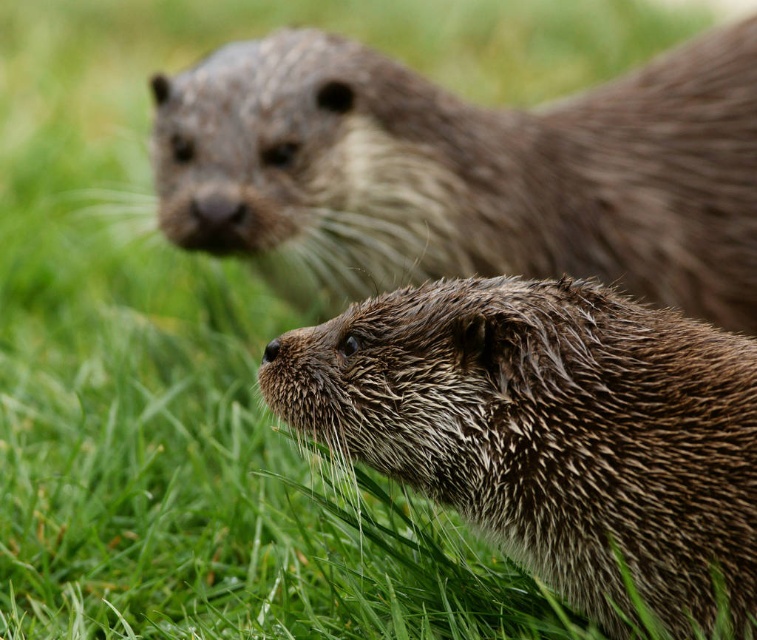
Question: Is brown fuzzy otter at upper center behind wet fur otter at center?

Choices:
 (A) no
 (B) yes

Answer: (B)

Question: Which of the following is the closest to the observer?

Choices:
 (A) brown fuzzy otter at upper center
 (B) wet fur otter at center

Answer: (B)

Question: Among these objects, which one is nearest to the camera?

Choices:
 (A) brown fuzzy otter at upper center
 (B) wet fur otter at center

Answer: (B)

Question: Is brown fuzzy otter at upper center smaller than wet fur otter at center?

Choices:
 (A) yes
 (B) no

Answer: (B)

Question: In this image, where is brown fuzzy otter at upper center located relative to wet fur otter at center?

Choices:
 (A) above
 (B) below

Answer: (A)